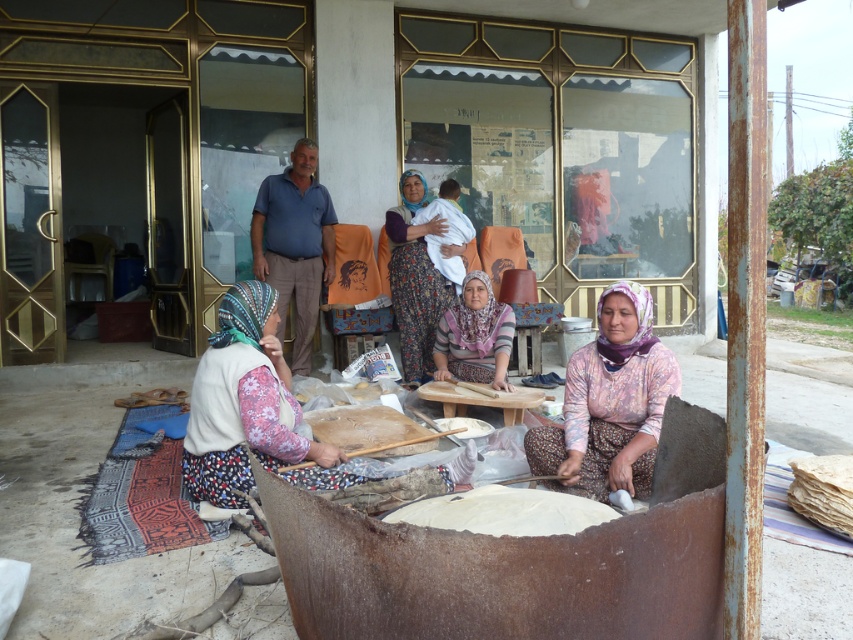
Question: Does floral fabric dress at center appear on the right side of white dough at center?

Choices:
 (A) yes
 (B) no

Answer: (B)

Question: Is floral fabric headscarf at lower left positioned in front of white dough at center?

Choices:
 (A) no
 (B) yes

Answer: (A)

Question: Where is floral fabric dress at center located in relation to pink fabric headscarf at center in the image?

Choices:
 (A) right
 (B) left

Answer: (B)

Question: Which point is closer to the camera?

Choices:
 (A) printed fabric headscarf at center
 (B) floral fabric dress at center
 (C) floral fabric headscarf at lower left
 (D) pink fabric headscarf at center

Answer: (C)

Question: Which point is farther to the camera?

Choices:
 (A) printed fabric headscarf at center
 (B) floral fabric dress at center
 (C) floral fabric headscarf at lower left
 (D) pink fabric headscarf at center

Answer: (B)

Question: Among these objects, which one is farthest from the camera?

Choices:
 (A) white dough at center
 (B) floral fabric dress at center
 (C) pink fabric headscarf at center
 (D) floral fabric headscarf at lower left

Answer: (B)